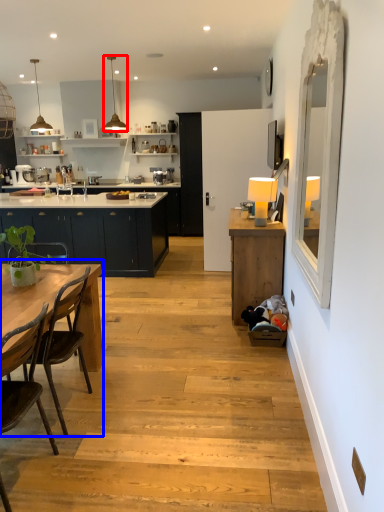
Question: Which object appears closest to the camera in this image, lamp (highlighted by a red box) or kitchen & dining room table (highlighted by a blue box)?

Choices:
 (A) lamp
 (B) kitchen & dining room table

Answer: (B)